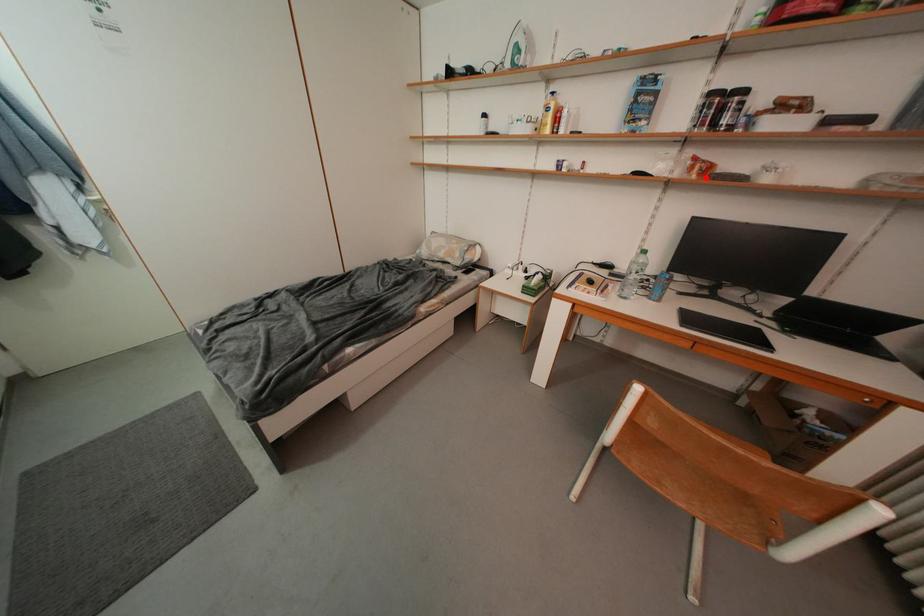
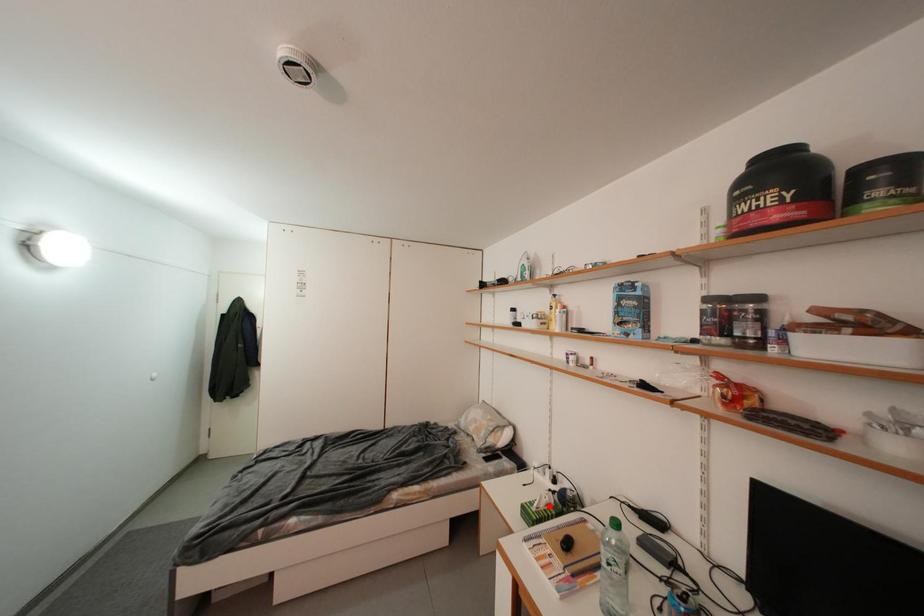
I am providing you with two images of the same scene from different viewpoints. A red point is marked on the first image and another point is marked on the second image. Does the point marked in image1 correspond to the same location as the one in image2?

No